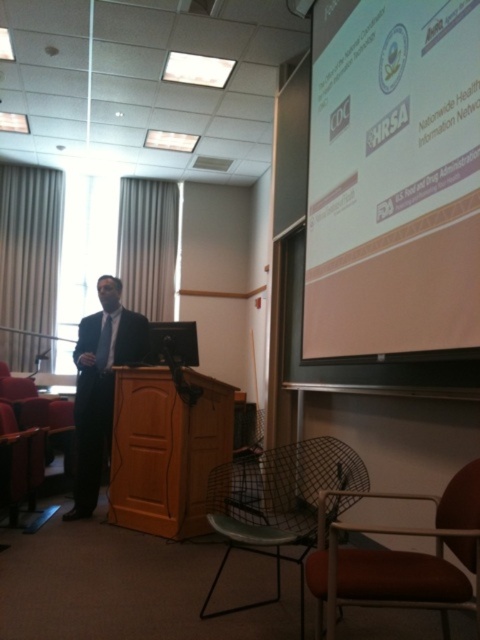
You are sitting in the green mesh chair at lower center and want to reach the wooden podium at center. Which direction should you move to get there?

You should move to your left to reach the wooden podium at center since it is located to the left of the green mesh chair at lower center.

You are sitting in the conference room and want to move from the point at coordinates (437, 161) to the point at coordinates (460, 500). Can you walk directly between these two points without any obstacles?

Point (437, 161) is behind point (460, 500), so you cannot walk directly between them because the first point is located behind the second one, possibly blocked by objects or the speaker in the scene.

You are sitting in the orange fabric chair at lower right and want to look at the white matte projection screen at upper right. Which direction should you turn your head to see it?

The white matte projection screen at upper right is further to the viewer than the orange fabric chair at lower right, so you should turn your head to the right to see it.